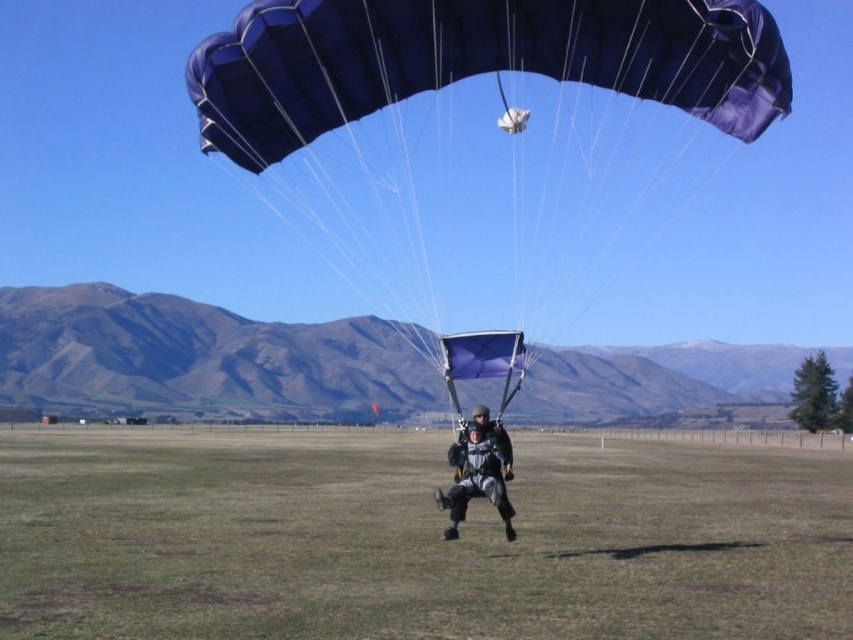
Is green grass at center below blue fabric parachute at center?

Yes, green grass at center is below blue fabric parachute at center.

Is green grass at center shorter than blue fabric parachute at center?

Indeed, green grass at center has a lesser height compared to blue fabric parachute at center.

Identify the location of green grass at center. (415, 540).

Can you confirm if blue fabric parachute at center is bigger than black fabric parachute at center?

Indeed, blue fabric parachute at center has a larger size compared to black fabric parachute at center.

Can you confirm if blue fabric parachute at center is positioned to the right of black fabric parachute at center?

Incorrect, blue fabric parachute at center is not on the right side of black fabric parachute at center.

Where is `blue fabric parachute at center`? This screenshot has height=640, width=853. blue fabric parachute at center is located at coordinates (476, 138).

Measure the distance from green grass at center to black fabric parachute at center.

green grass at center and black fabric parachute at center are 29.50 meters apart from each other.

Can you confirm if green grass at center is positioned to the left of black fabric parachute at center?

Indeed, green grass at center is positioned on the left side of black fabric parachute at center.

Is point (566, 563) positioned after point (489, 449)?

No, it is not.

The image size is (853, 640). I want to click on green grass at center, so click(415, 540).